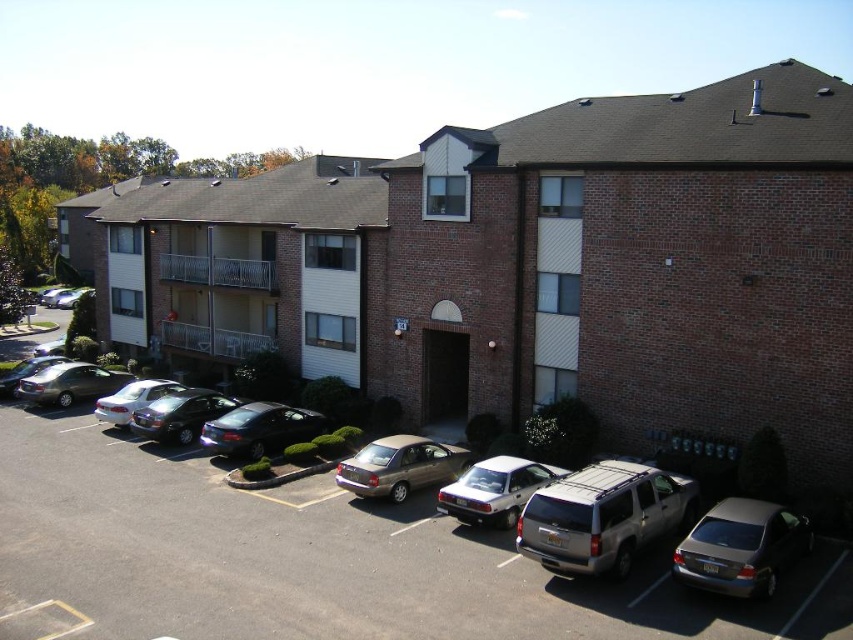
You are a delivery driver who needs to park your truck next to the metallic silver car at center and the satin black sedan at center. Since your truck is 5 meters long, can you fit it between them without overlapping any parked vehicles?

The metallic silver car at center is bigger than the satin black sedan at center, but the exact distance between them isn not provided. Without knowing the space between the two cars, it is impossible to determine if the truck will fit.

You are standing at the entrance of the residential building and want to find the metallic silver car at center. Based on the parking lot layout described, which direction should you look to locate it?

The metallic silver car at center is located at point coordinates that are not explicitly directional, so the exact direction depends on the parking lot layout. However, since it is at the center, looking straight ahead or slightly to the right might be the best starting point based on typical parking lot designs.

You are standing at the point closest to the building in the parking lot. There are two points marked in the parking lot labeled as point (405, 442) and point (100, 378). Which point is closer to the building?

Point (100, 378) is closer to the building because it is behind point (405, 442), meaning it is nearer to the structure.